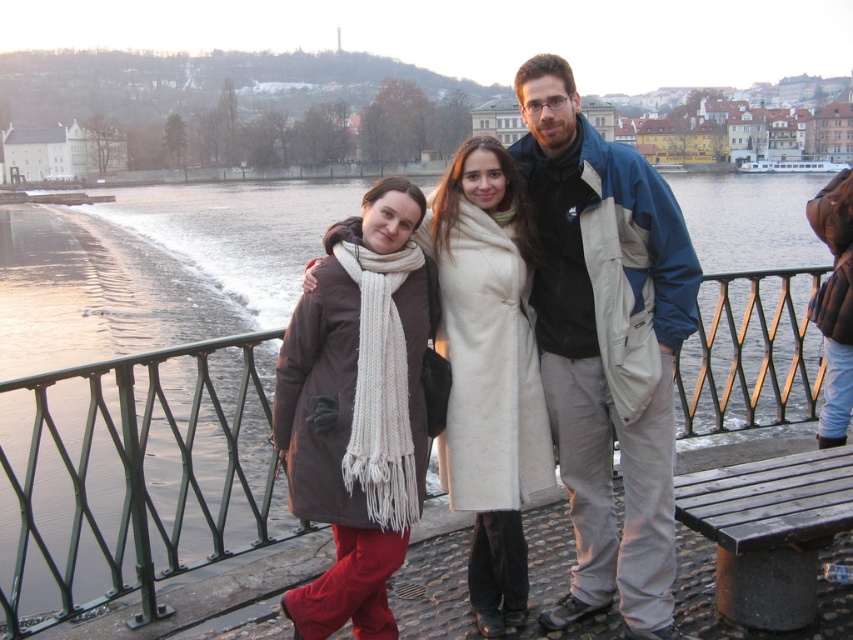
Can you confirm if white knitted scarf at center is positioned to the left of white woolen coat at center?

Yes, white knitted scarf at center is to the left of white woolen coat at center.

Consider the image. Can you confirm if white knitted scarf at center is positioned below white woolen coat at center?

Yes.

Is point (392, 291) positioned after point (492, 145)?

No, it is not.

Identify the location of white knitted scarf at center. (358, 408).

Who is more forward, (x=68, y=493) or (x=544, y=90)?

Point (x=544, y=90)

Which is above, green metal railing at center or matte white coat at center?

matte white coat at center is higher up.

Between point (265, 332) and point (618, 225), which one is positioned behind?

Positioned behind is point (265, 332).

Find the location of a particular element. This screenshot has width=853, height=640. green metal railing at center is located at coordinates (132, 476).

Which of these two, white woolen coat at center or wooden bench at lower right, stands shorter?

wooden bench at lower right is shorter.

Identify the location of white woolen coat at center. This screenshot has width=853, height=640. (489, 372).